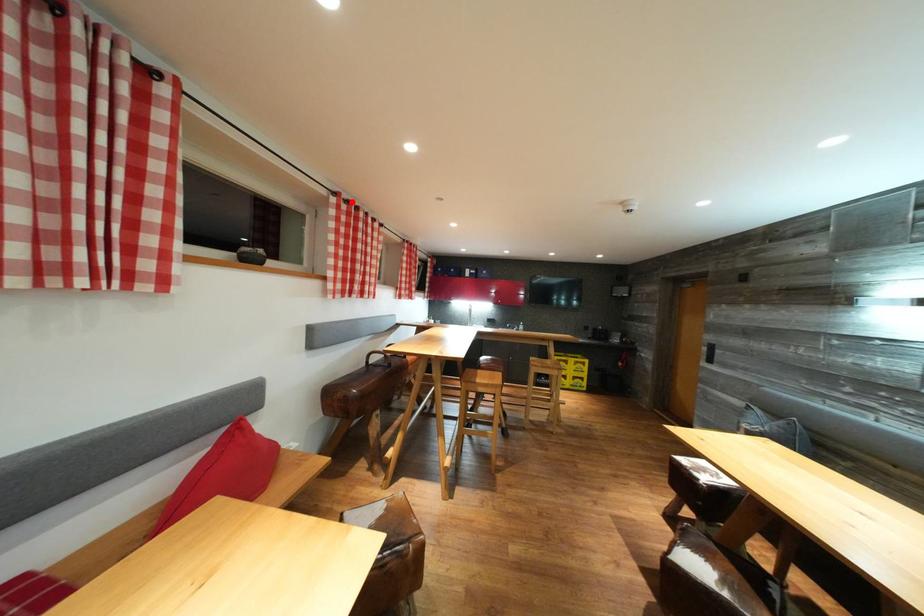
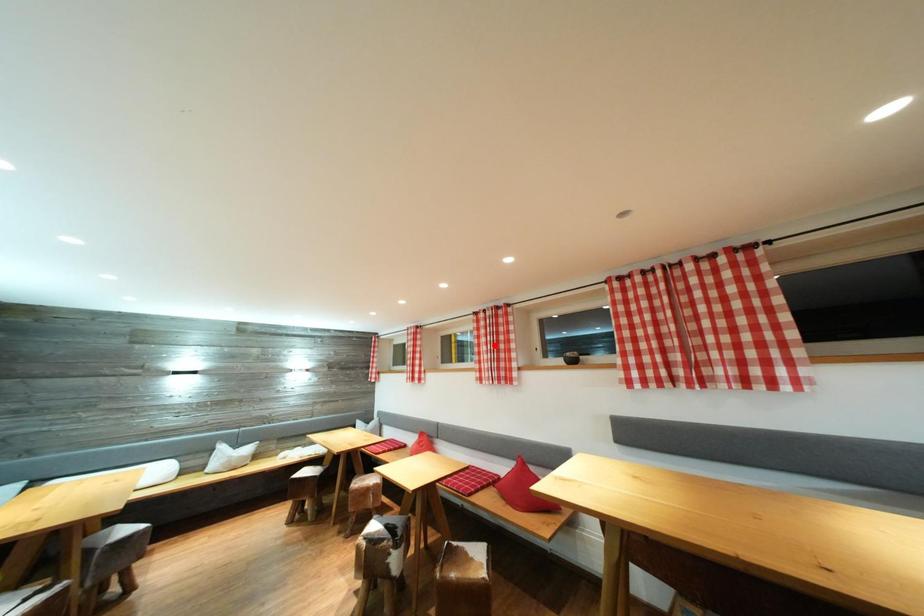
I am providing you with two images of the same scene from different viewpoints. A red point is marked on the first image and another point is marked on the second image. Do the highlighted points in image1 and image2 indicate the same real-world spot?

No